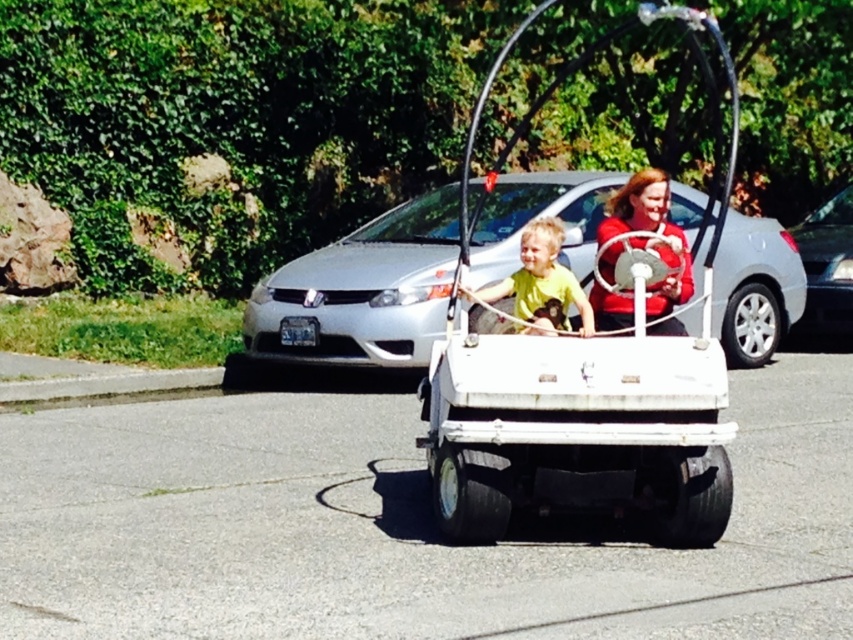
You are a safety inspector checking the positioning of the driver and passenger in the white matte car at center. According to safety guidelines, the driver should be positioned in front of the vehicle. Is the matte red shirt at center, which belongs to the driver, correctly positioned?

The matte red shirt at center is behind the white matte car at center, which means the driver is positioned behind the vehicle instead of in front. This violates safety guidelines, so the positioning is incorrect.

You are standing on the sidewalk and see the white matte golf cart at center and the yellow matte shirt at center. Which object is positioned more to the right side of the scene?

The white matte golf cart at center is positioned more to the right side of the scene than the yellow matte shirt at center.

You are a delivery drone operator. You need to deliver a package to the passenger in the yellow matte shirt at center, who is riding in the white matte golf cart at center. The drone has a maximum delivery range of 30 centimeters. Can the drone safely deliver the package to the passenger?

Answer: The white matte golf cart at center and yellow matte shirt at center are 32.60 centimeters apart. Since the drone has a maximum delivery range of 30 centimeters, it cannot safely deliver the package as the distance exceeds the drone s range.